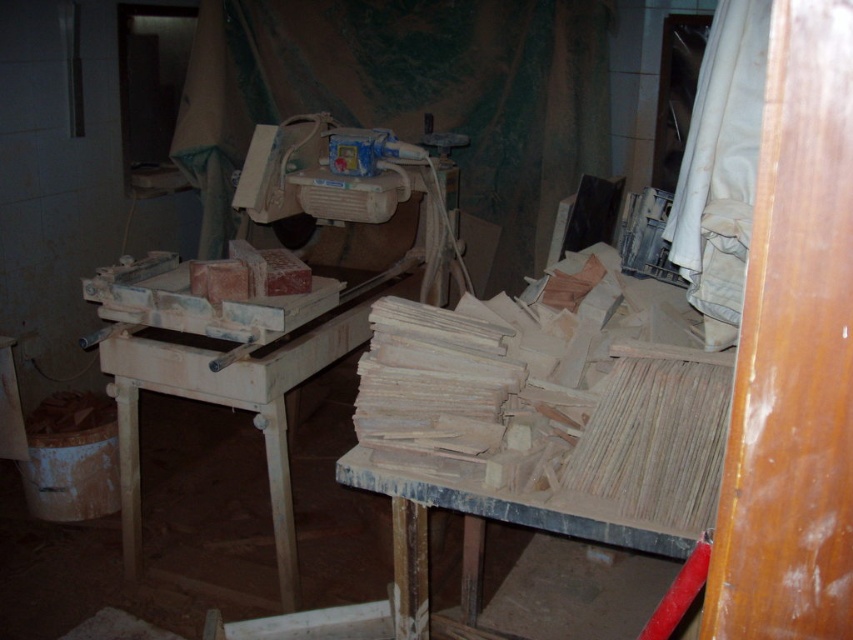
You are standing at the entrance of the workshop and see the point marked at coordinates [221,365]. What is the object located at this point?

The point at coordinates [221,365] is located on the wooden table at center.

You are a carpenter who needs to place a heavy tool on the wooden table at center and the wooden at center. Which surface can support the tool better?

The wooden table at center has a greater height compared to wooden at center, so it is more likely to be the sturdy surface capable of supporting heavy tools.